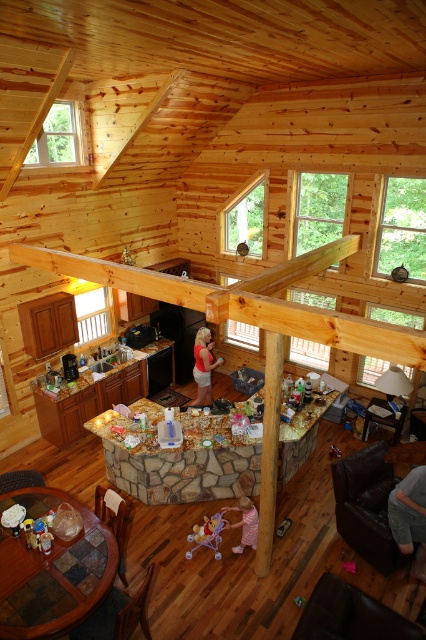
Is gray cotton shirt at lower right shorter than matte red blouse at center?

Yes.

Based on the photo, is gray cotton shirt at lower right closer to the viewer compared to matte red blouse at center?

Yes, it is in front of matte red blouse at center.

Is point (414, 568) closer to camera compared to point (207, 397)?

That is True.

The image size is (426, 640). Identify the location of gray cotton shirt at lower right. (409, 516).

Who is more distant from viewer, [152,484] or [54,614]?

Point [152,484]

Describe the element at coordinates (181, 461) in the screenshot. I see `stonework/dark wood dining table at center` at that location.

Is point (241, 449) positioned after point (26, 605)?

Yes.

Where is `stonework/dark wood dining table at center`? The image size is (426, 640). stonework/dark wood dining table at center is located at coordinates (181, 461).

The image size is (426, 640). In order to click on stonework/dark wood dining table at center in this screenshot , I will do `click(181, 461)`.

Does stonework/dark wood dining table at center have a greater width compared to matte red blouse at center?

Correct, the width of stonework/dark wood dining table at center exceeds that of matte red blouse at center.

I want to click on stonework/dark wood dining table at center, so click(x=181, y=461).

Identify the location of stonework/dark wood dining table at center. (181, 461).